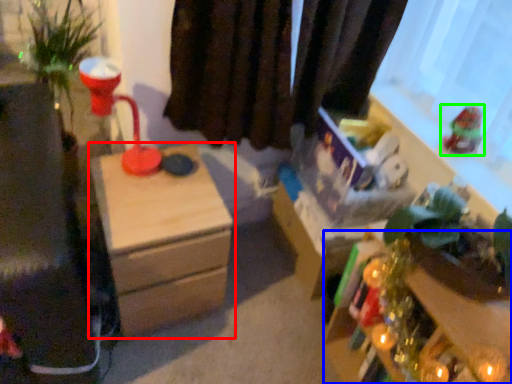
Question: Based on their relative distances, which object is nearer to nightstand (highlighted by a red box)? Choose from table (highlighted by a blue box) and toy (highlighted by a green box).

Choices:
 (A) table
 (B) toy

Answer: (A)